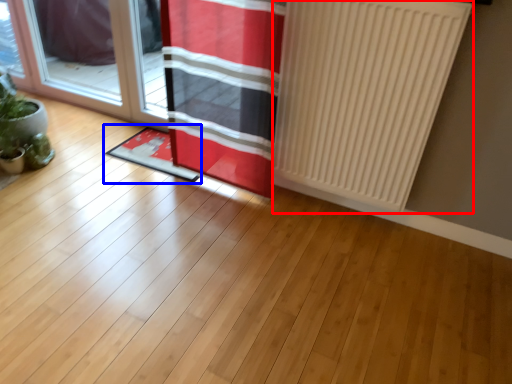
Question: Which point is closer to the camera, radiator (highlighted by a red box) or doormat (highlighted by a blue box)?

Choices:
 (A) radiator
 (B) doormat

Answer: (A)